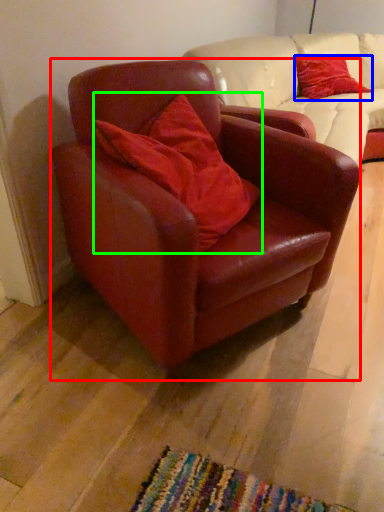
Question: Considering the real-world distances, which object is farthest from chair (highlighted by a red box)? pillow (highlighted by a blue box) or pillow (highlighted by a green box)?

Choices:
 (A) pillow
 (B) pillow

Answer: (A)